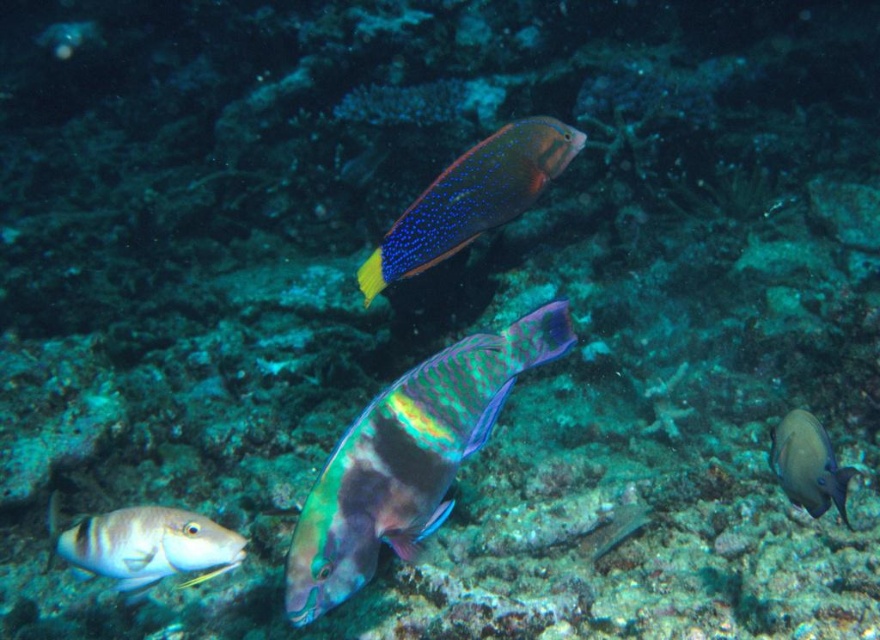
Question: Which of these objects is positioned closest to the smooth gray fish at lower right?

Choices:
 (A) shiny silver fish at lower left
 (B) shiny iridescent fish at center

Answer: (B)

Question: Among these points, which one is farthest from the camera?

Choices:
 (A) (66, 536)
 (B) (464, 380)

Answer: (A)

Question: Which point is closer to the camera taking this photo?

Choices:
 (A) [x=803, y=417]
 (B) [x=158, y=531]
 (C) [x=457, y=218]

Answer: (C)

Question: Is shiny iridescent fish at center to the right of shiny silver fish at lower left from the viewer's perspective?

Choices:
 (A) no
 (B) yes

Answer: (B)

Question: Is shiny iridescent fish at center positioned in front of shiny blue and yellow fish at upper center?

Choices:
 (A) no
 (B) yes

Answer: (B)

Question: Does shiny silver fish at lower left lie behind smooth gray fish at lower right?

Choices:
 (A) no
 (B) yes

Answer: (B)